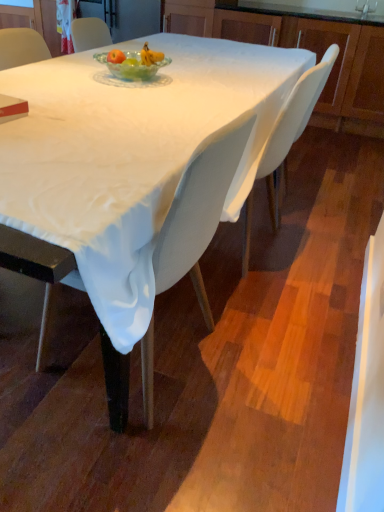
This screenshot has width=384, height=512. In order to click on spots to the right of white fabric chair at center, the 1th chair viewed from the left in this screenshot , I will do `click(267, 375)`.